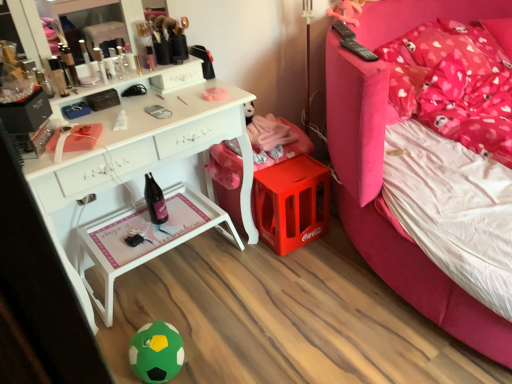
Question: Is green felt ball at lower center in front of pink fabric pillow at upper right?

Choices:
 (A) no
 (B) yes

Answer: (B)

Question: Can you confirm if green felt ball at lower center is bigger than pink fabric pillow at upper right?

Choices:
 (A) yes
 (B) no

Answer: (B)

Question: Could you tell me if green felt ball at lower center is turned towards pink fabric pillow at upper right?

Choices:
 (A) no
 (B) yes

Answer: (A)

Question: Does green felt ball at lower center have a greater height compared to pink fabric pillow at upper right?

Choices:
 (A) no
 (B) yes

Answer: (A)

Question: From a real-world perspective, is green felt ball at lower center on pink fabric pillow at upper right?

Choices:
 (A) yes
 (B) no

Answer: (B)

Question: Does green felt ball at lower center have a smaller size compared to pink fabric pillow at upper right?

Choices:
 (A) no
 (B) yes

Answer: (B)

Question: From a real-world perspective, is matte black compact at upper left under pink fabric bed at upper right?

Choices:
 (A) no
 (B) yes

Answer: (A)

Question: From the image's perspective, is matte black compact at upper left beneath pink fabric bed at upper right?

Choices:
 (A) no
 (B) yes

Answer: (A)

Question: Can you confirm if matte black compact at upper left is positioned to the right of pink fabric bed at upper right?

Choices:
 (A) yes
 (B) no

Answer: (B)

Question: Is matte black compact at upper left at the left side of pink fabric bed at upper right?

Choices:
 (A) no
 (B) yes

Answer: (B)

Question: Does matte black compact at upper left have a greater height compared to pink fabric bed at upper right?

Choices:
 (A) no
 (B) yes

Answer: (A)

Question: Would you say pink fabric bed at upper right is part of matte black compact at upper left's contents?

Choices:
 (A) yes
 (B) no

Answer: (B)

Question: Is white wood tray at lower center smaller than pink fabric bed at upper right?

Choices:
 (A) yes
 (B) no

Answer: (A)